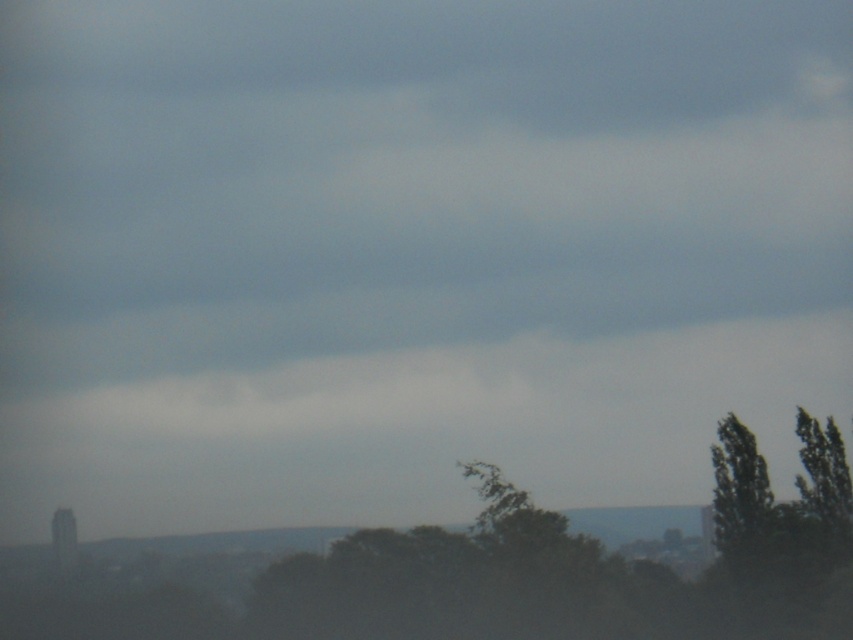
Who is higher up, green matte tree at center or green leafy tree at right?

green leafy tree at right is higher up.

Does green matte tree at center appear on the left side of green leafy tree at right?

Yes, green matte tree at center is to the left of green leafy tree at right.

Describe the element at coordinates (465, 572) in the screenshot. I see `green matte tree at center` at that location.

Locate an element on the screen. green matte tree at center is located at coordinates (x=465, y=572).